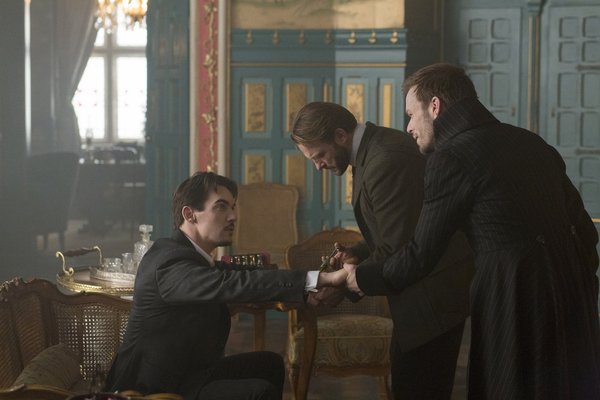
Find the location of a particular element. window is located at coordinates (141, 91).